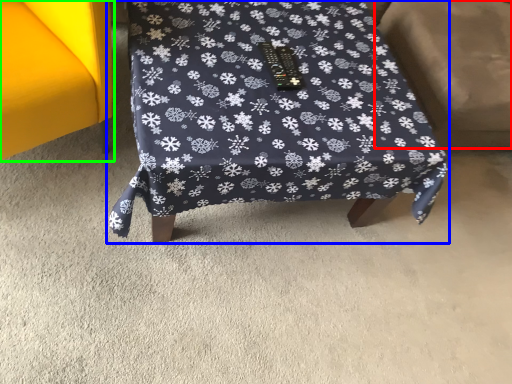
Question: Considering the real-world distances, which object is farthest from swivel chair (highlighted by a red box)? furniture (highlighted by a blue box) or furniture (highlighted by a green box)?

Choices:
 (A) furniture
 (B) furniture

Answer: (B)